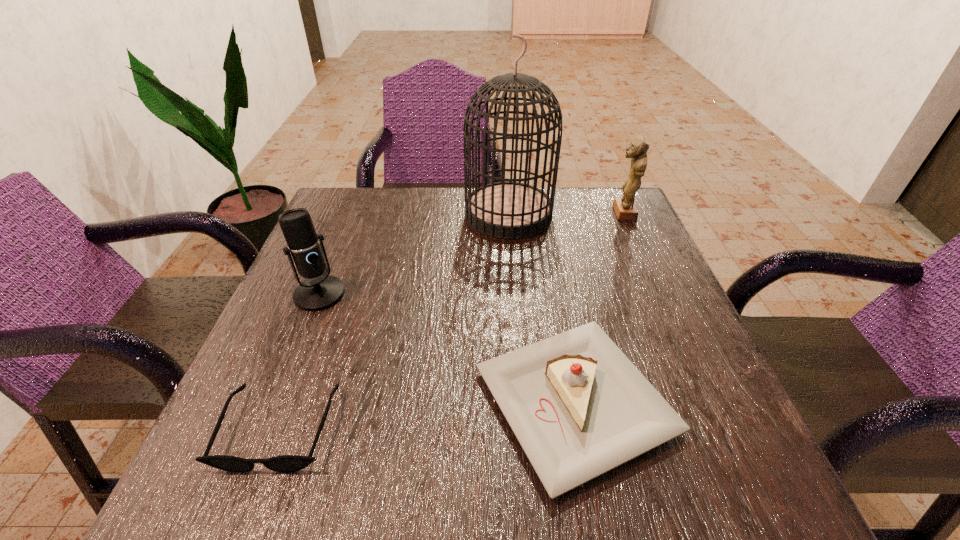
Find the location of a particular element. This screenshot has height=540, width=960. vacant position located on the left of the cake is located at coordinates (278, 401).

Locate an element on the screen. birdcage that is positioned at the far edge is located at coordinates (507, 210).

This screenshot has height=540, width=960. Find the location of `figurine at the far edge`. figurine at the far edge is located at coordinates (625, 209).

You are a GUI agent. You are given a task and a screenshot of the screen. Output one action in this format:
    pyautogui.click(x=<x>, y=<y>)
    Task: Click on the cake that is at the near edge
    
    Given the screenshot: What is the action you would take?
    pyautogui.click(x=579, y=408)

The width and height of the screenshot is (960, 540). I want to click on sunglasses that is at the near edge, so click(285, 463).

The image size is (960, 540). Find the location of `microphone that is at the left edge`. microphone that is at the left edge is located at coordinates (319, 291).

Find the location of a particular element. sunglasses that is at the left edge is located at coordinates (285, 463).

I want to click on figurine situated at the right edge, so click(625, 209).

Identify the location of cake that is at the right edge. The height and width of the screenshot is (540, 960). (579, 408).

Locate an element on the screen. The image size is (960, 540). object that is at the near left corner is located at coordinates (285, 463).